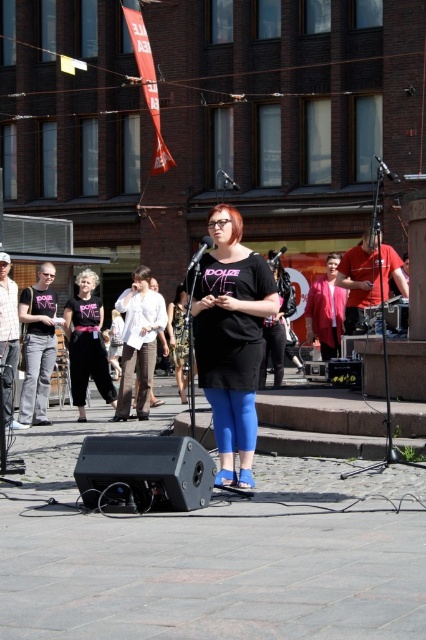
Question: Based on their relative distances, which object is nearer to the matte black pants at center?

Choices:
 (A) metallic silver microphone at center
 (B) light brown leather jacket at center
 (C) matte red shirt at center

Answer: (B)

Question: Is white cotton shirt at center smaller than matte black pants at center?

Choices:
 (A) no
 (B) yes

Answer: (B)

Question: Which object is positioned closest to the white cotton shirt at center?

Choices:
 (A) black matte dress at center
 (B) light brown leather jacket at center
 (C) matte black pants at center
 (D) matte red shirt at center

Answer: (C)

Question: Which point is closer to the camera?

Choices:
 (A) (227, 180)
 (B) (313, 301)
 (C) (129, 410)

Answer: (B)

Question: Is matte red shirt at center to the right of light brown leather jacket at center from the viewer's perspective?

Choices:
 (A) no
 (B) yes

Answer: (B)

Question: Is white cotton shirt at center to the left of metallic silver microphone at upper right from the viewer's perspective?

Choices:
 (A) no
 (B) yes

Answer: (B)